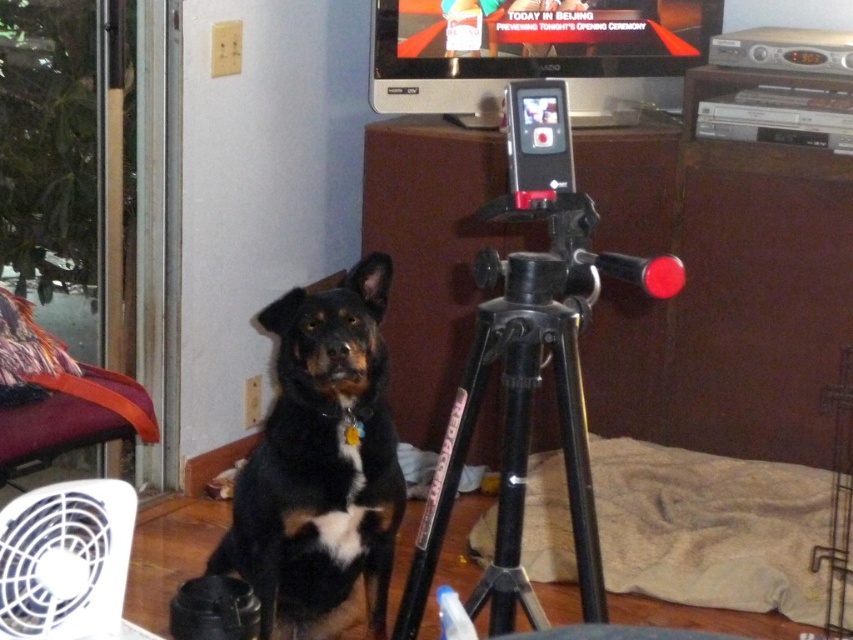
Between black fur dog at center and black matte tripod at center, which one is positioned higher?

black matte tripod at center is above.

Locate an element on the screen. The image size is (853, 640). black fur dog at center is located at coordinates (320, 465).

This screenshot has width=853, height=640. I want to click on black fur dog at center, so click(x=320, y=465).

Between point (514, 460) and point (131, 518), which one is positioned behind?

The point (514, 460) is more distant.

Measure the distance between point (537, 209) and camera.

Point (537, 209) is 4.59 feet from camera.

This screenshot has height=640, width=853. Find the location of `black matte tripod at center`. black matte tripod at center is located at coordinates (527, 400).

At what (x,y) coordinates should I click in order to perform the action: click on black matte tripod at center. Please return your answer as a coordinate pair (x, y). The image size is (853, 640). Looking at the image, I should click on (527, 400).

At what (x,y) coordinates should I click in order to perform the action: click on black fur dog at center. Please return your answer as a coordinate pair (x, y). This screenshot has height=640, width=853. Looking at the image, I should click on (320, 465).

Can you confirm if black fur dog at center is positioned to the left of white plastic fan at lower left?

Incorrect, black fur dog at center is not on the left side of white plastic fan at lower left.

Where is `black fur dog at center`? The image size is (853, 640). black fur dog at center is located at coordinates (320, 465).

The width and height of the screenshot is (853, 640). What are the coordinates of `black fur dog at center` in the screenshot? It's located at (320, 465).